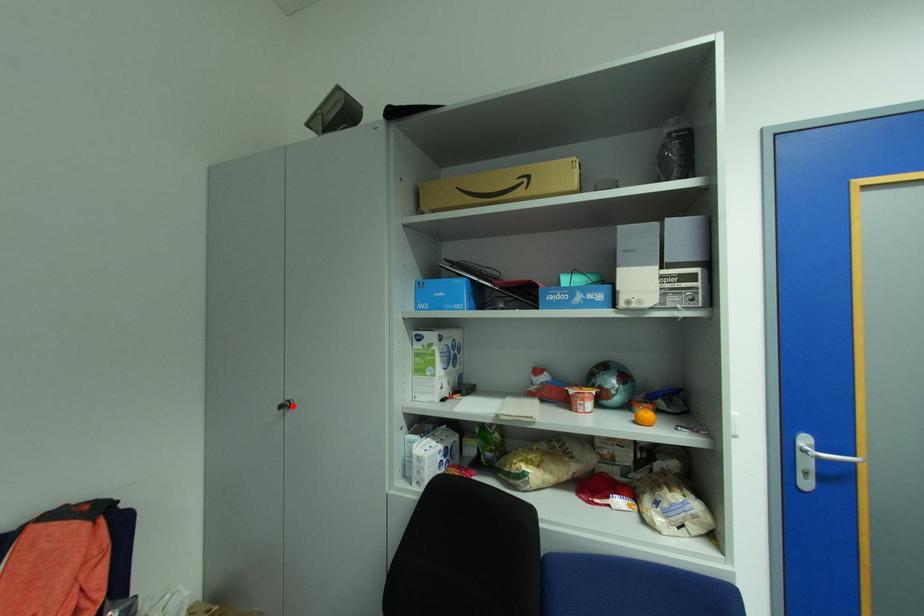
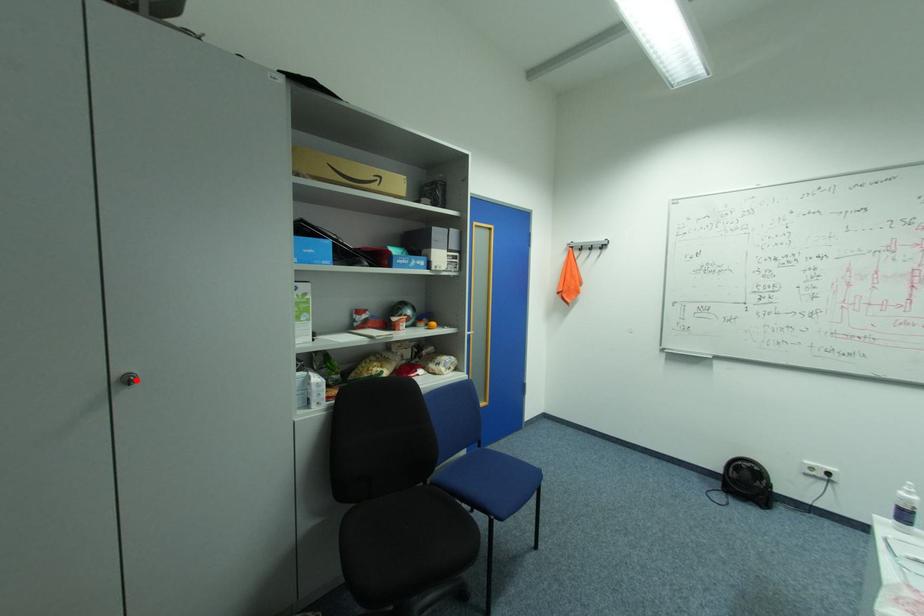
I am providing you with two images of the same scene from different viewpoints. A red point is marked on the first image and another point is marked on the second image. Do the highlighted points in image1 and image2 indicate the same real-world spot?

Yes